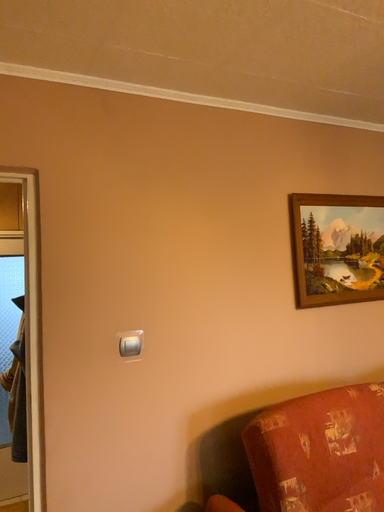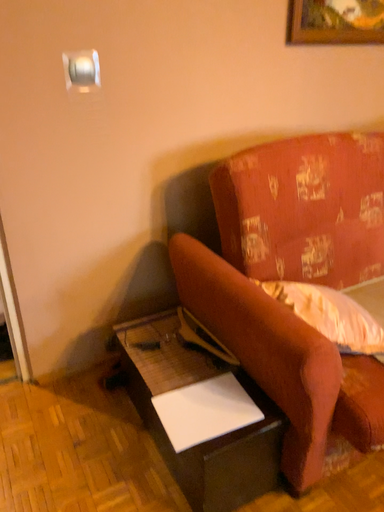
Question: Which way did the camera rotate in the video?

Choices:
 (A) rotated downward
 (B) rotated upward

Answer: (A)